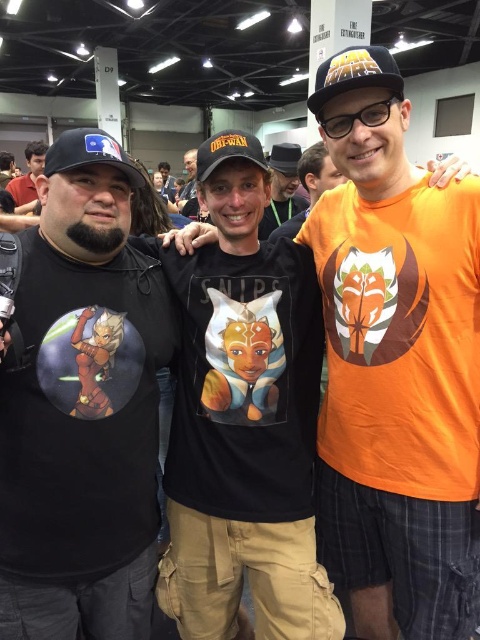
You are a photographer at the event and need to adjust the lighting to ensure both the matte black shirt at left and the black felt baseball hat at center are well lit. Since they are different distances from the camera, which one should you focus on first to ensure proper exposure?

The matte black shirt at left is located above the black felt baseball hat at center, so focusing on the matte black shirt at left first will ensure it is properly exposed since it is closer to the camera.

You are a photographer at the event and need to ensure that both black fabric baseball cap at left and black matte baseball cap at center are visible in the photo. Given their sizes, which cap might you need to adjust your camera angle to better capture in the frame?

The black fabric baseball cap at left is larger in size compared to the black matte baseball cap at center, so you might need to adjust the camera angle to accommodate its larger size to ensure it fits well within the frame.